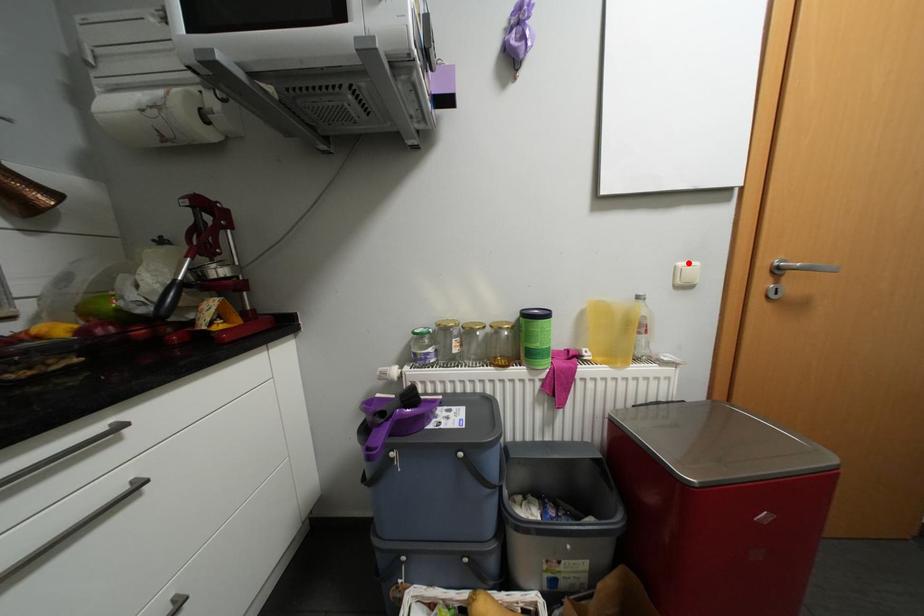
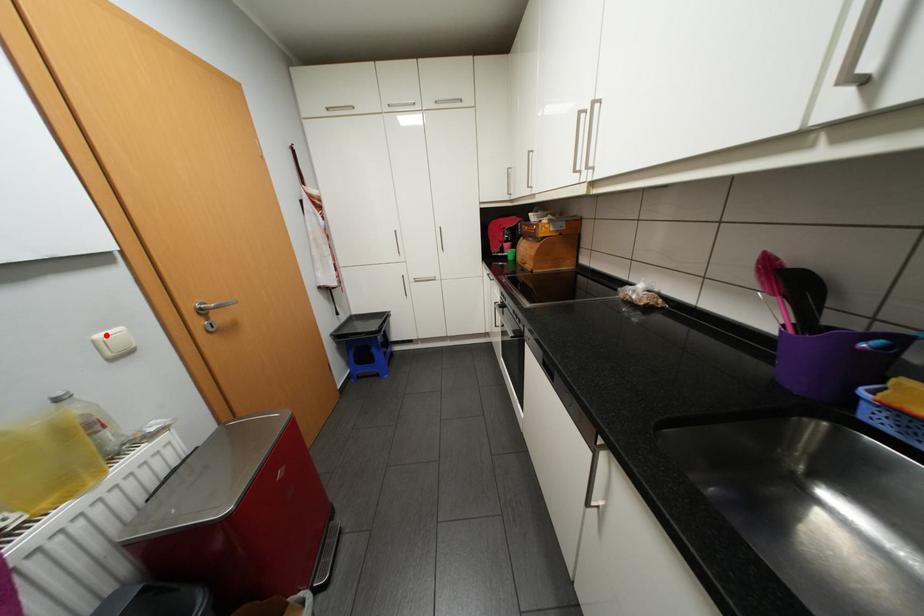
I am providing you with two images of the same scene from different viewpoints. A red point is marked on the first image and another point is marked on the second image. Does the point marked in image1 correspond to the same location as the one in image2?

Yes